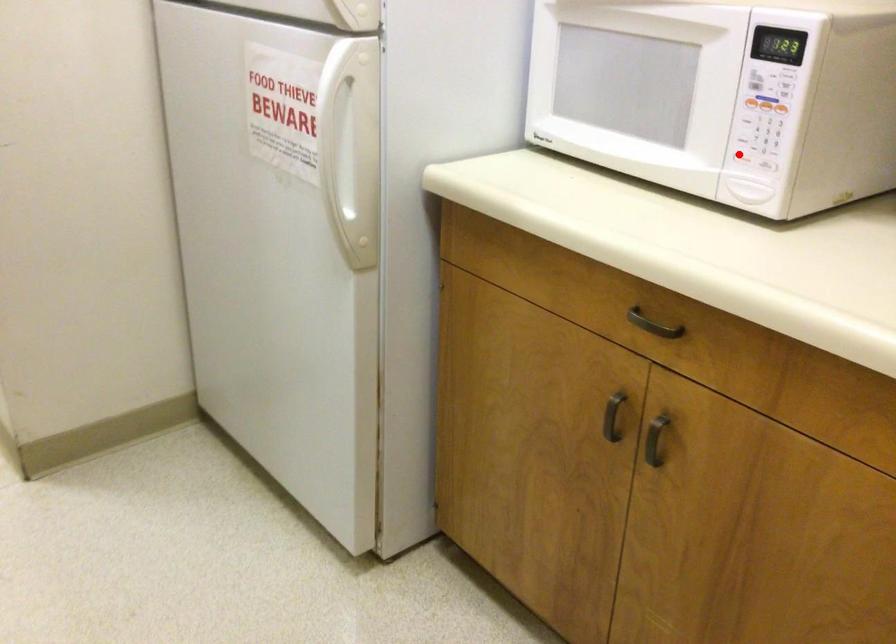
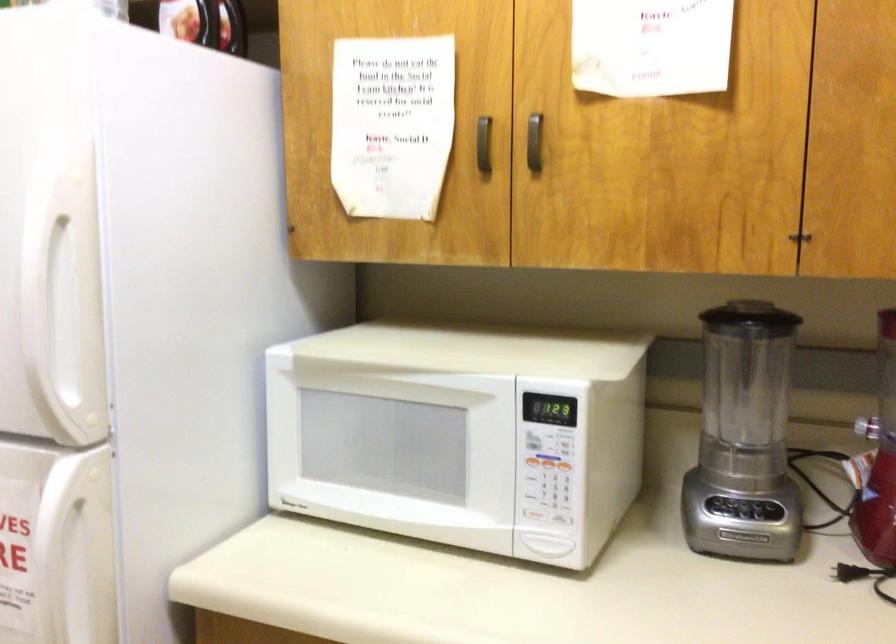
In the second image, find the point that corresponds to the highlighted location in the first image.

(533, 515)